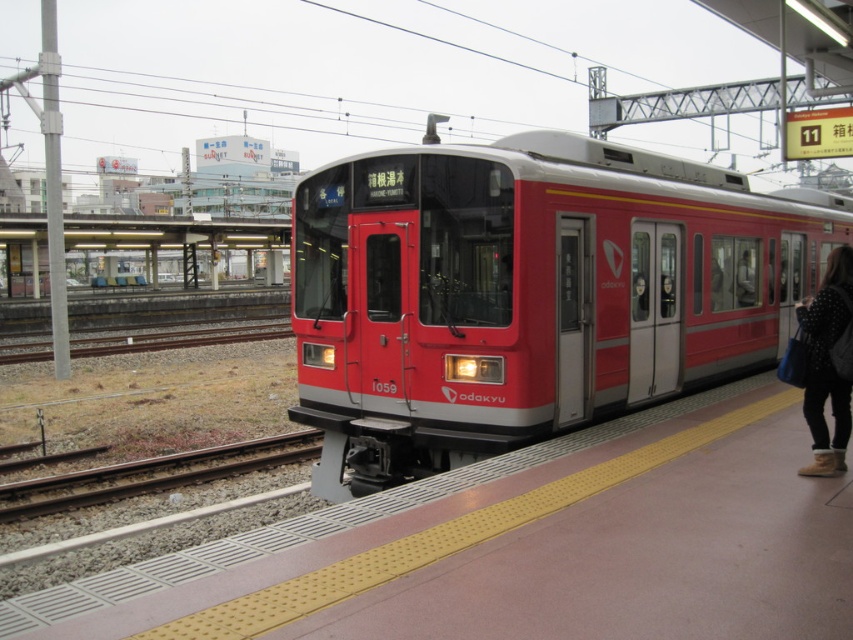
Is matte red train at center wider than gravel railway track at lower left?

Yes, matte red train at center is wider than gravel railway track at lower left.

In order to click on matte red train at center in this screenshot , I will do `click(527, 292)`.

Does gravel railway track at lower left come behind gravel at track left?

No, it is not.

Is gravel railway track at lower left bigger than gravel at track left?

No, gravel railway track at lower left is not bigger than gravel at track left.

Does point (108, 486) come behind point (132, 337)?

No, it is not.

I want to click on gravel railway track at lower left, so click(x=151, y=474).

Is leather jacket at right smaller than gravel at track left?

Correct, leather jacket at right occupies less space than gravel at track left.

Is leather jacket at right below gravel at track left?

Incorrect, leather jacket at right is not positioned below gravel at track left.

Who is more forward, (x=844, y=289) or (x=38, y=355)?

Positioned in front is point (x=844, y=289).

Locate an element on the screen. leather jacket at right is located at coordinates (827, 364).